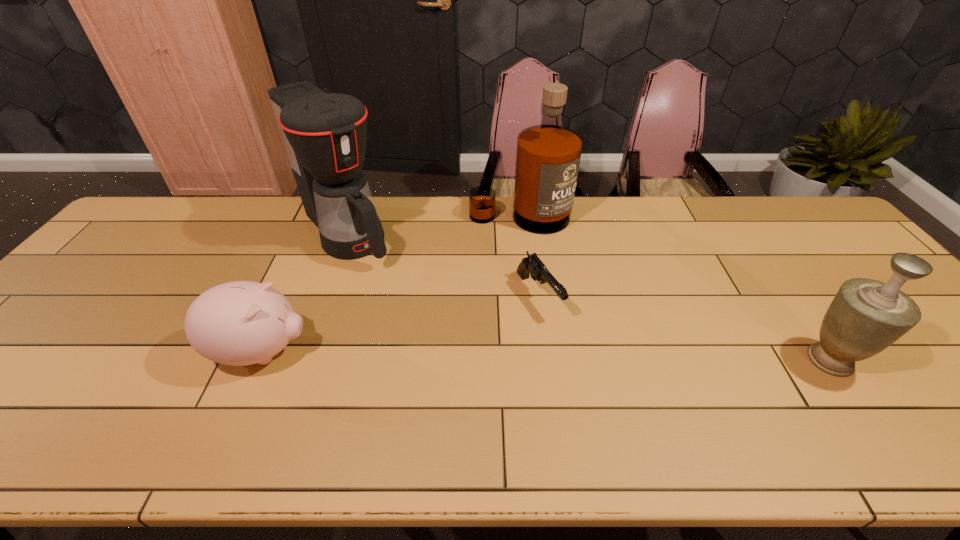
Locate an element on the screen. the fourth tallest object is located at coordinates (238, 323).

What are the coordinates of `the rightmost object` in the screenshot? It's located at (866, 316).

Identify the location of urn. This screenshot has height=540, width=960. 866,316.

At what (x,y) coordinates should I click in order to perform the action: click on coffee maker. Please return your answer as a coordinate pair (x, y). Looking at the image, I should click on (324, 134).

This screenshot has width=960, height=540. In order to click on liquor in this screenshot , I will do `click(548, 155)`.

Locate an element on the screen. the shortest object is located at coordinates (532, 265).

The image size is (960, 540). Identify the location of blank space located 0.180m at the snout of the fourth tallest object. (x=388, y=352).

Identify the location of free point located on the right of the urn. The width and height of the screenshot is (960, 540). (880, 360).

The image size is (960, 540). I want to click on free location located pour from the carafe of the coffee maker, so click(x=442, y=339).

This screenshot has width=960, height=540. In order to click on free space located pour from the carafe of the coffee maker in this screenshot , I will do `click(411, 306)`.